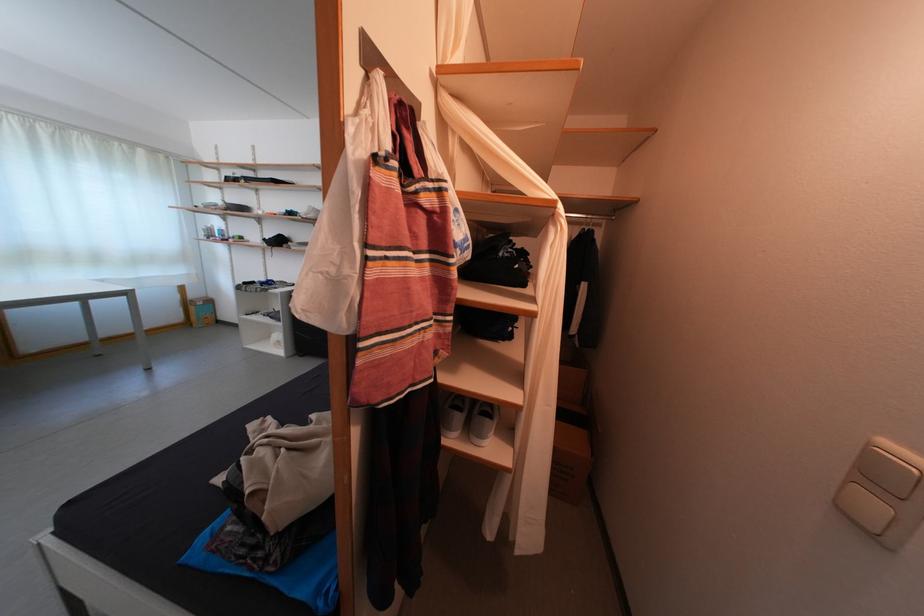
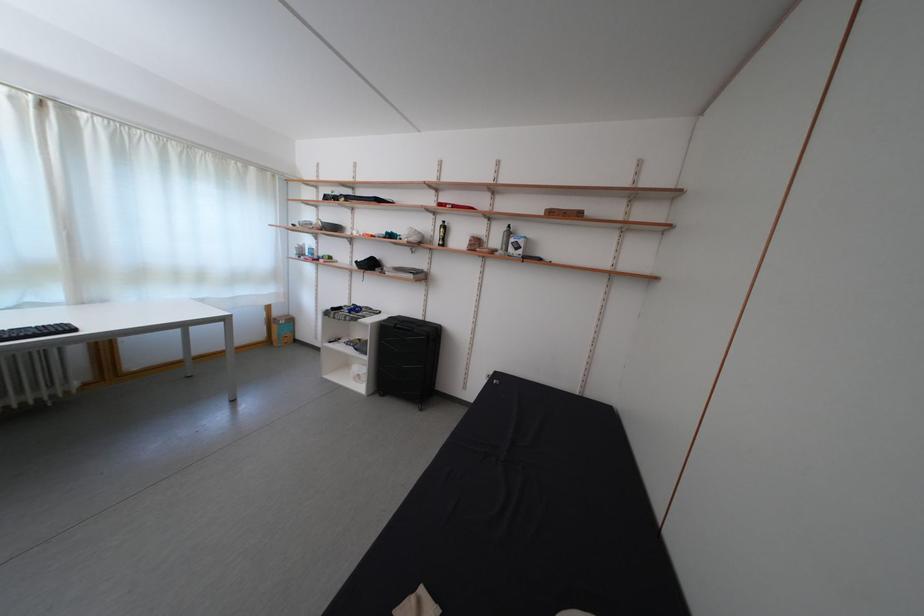
Which direction would the cameraman need to move to produce the second image?

The movement direction of the cameraman is left, forward.